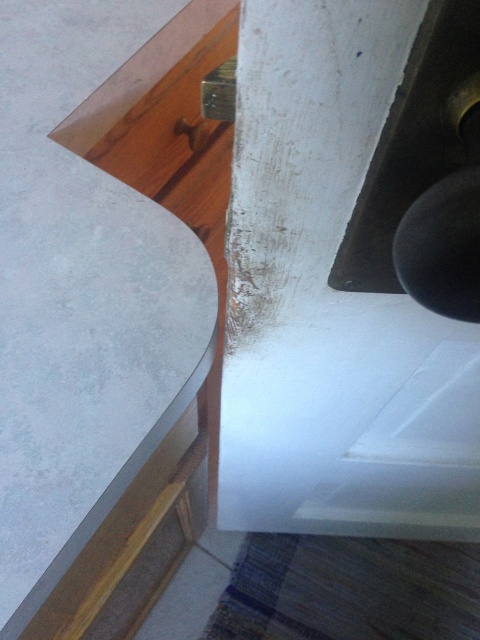
You are organizing a small plant that needs to be placed between the matte concrete countertop at center and the matte wood drawer at lower left. Which object should the plant be placed closer to based on their positions?

The matte concrete countertop at center is to the left of the matte wood drawer at lower left, so the plant should be placed closer to the matte wood drawer at lower left since it is positioned to the right of the countertop.

You are standing in the corner where the curved white surface and the weathered white wall meet. You notice two points marked on the surfaces. Are you closer to the point at coordinates point (73, 54) or point (78, 625)?

You are closer to the point at coordinates point (73, 54) because it is closer to the viewer than the other point.